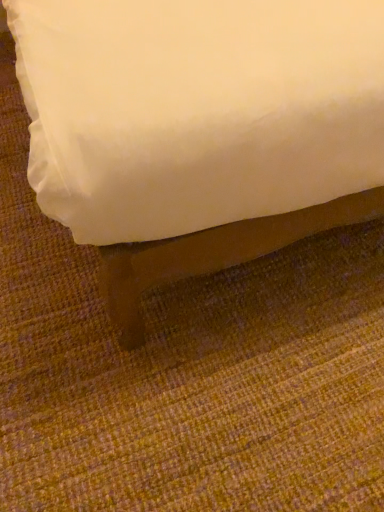
What is the approximate width of white fabric bed at upper center?

white fabric bed at upper center is 6.90 feet in width.

This screenshot has width=384, height=512. What do you see at coordinates (227, 189) in the screenshot? I see `white fabric bed at upper center` at bounding box center [227, 189].

The height and width of the screenshot is (512, 384). In order to click on white fabric bed at upper center in this screenshot , I will do `click(227, 189)`.

Identify the location of white fabric bed at upper center. (227, 189).